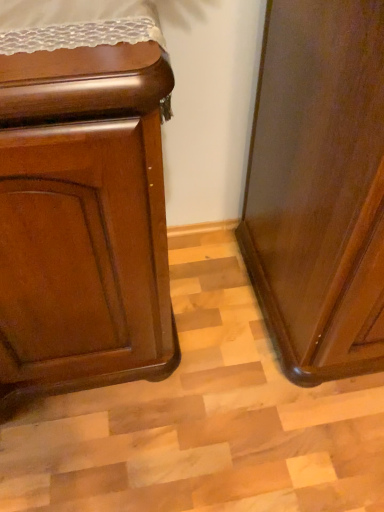
Identify the location of glossy wood nightstand at left. This screenshot has width=384, height=512. (84, 208).

The height and width of the screenshot is (512, 384). What do you see at coordinates (84, 208) in the screenshot?
I see `glossy wood nightstand at left` at bounding box center [84, 208].

In order to click on glossy wood nightstand at left in this screenshot , I will do `click(84, 208)`.